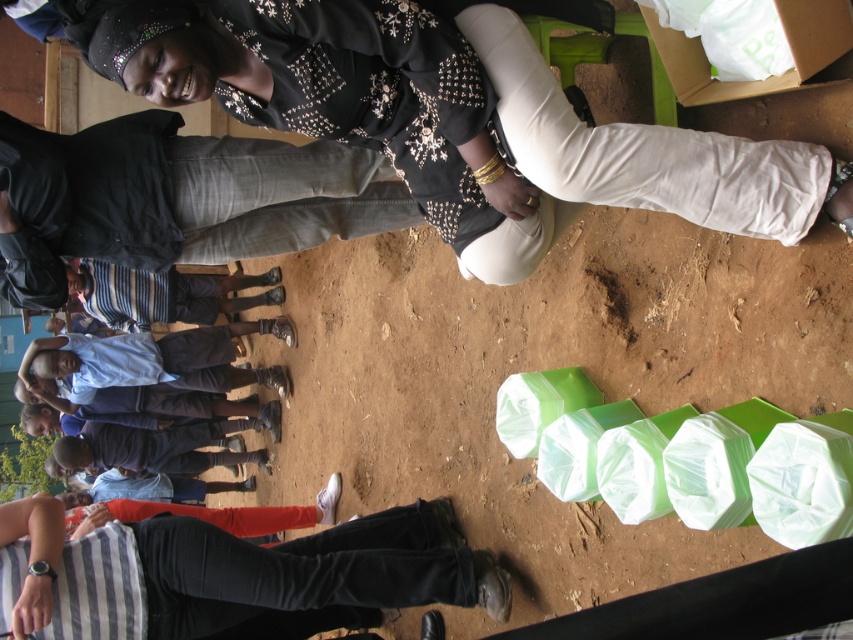
You are a photographer taking a picture of the matte black blouse at upper center and the black jeans at lower center. Which one will appear smaller in the final photo?

The matte black blouse at upper center appears smaller in the photo because it is not as tall as the black jeans at lower center, indicating it is farther away from the camera.

You are a photographer taking a picture of the community event. You notice the black jeans at lower center and the blue shirt at lower left. Which one is closer to the camera?

The black jeans at lower center is in front of the blue shirt at lower left, so it is closer to the camera.